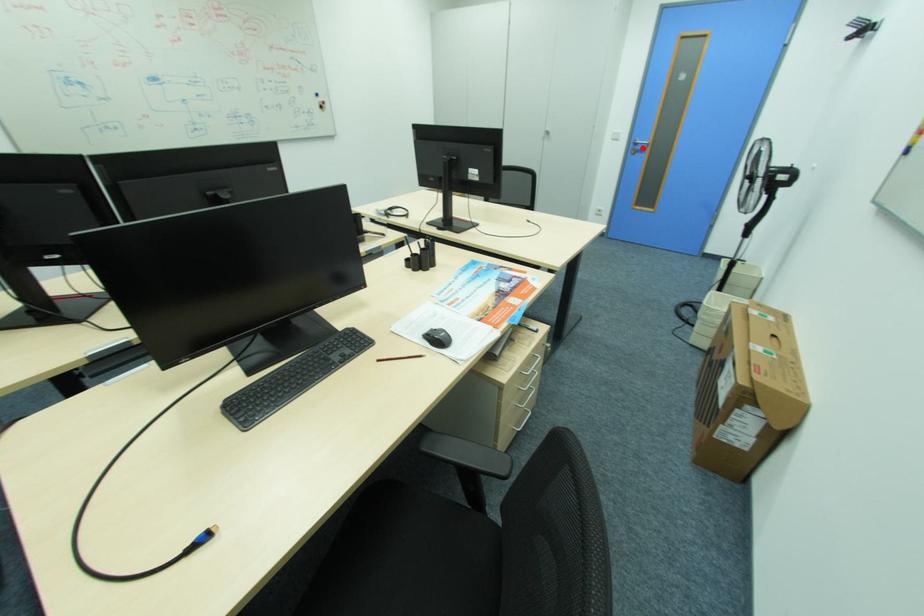
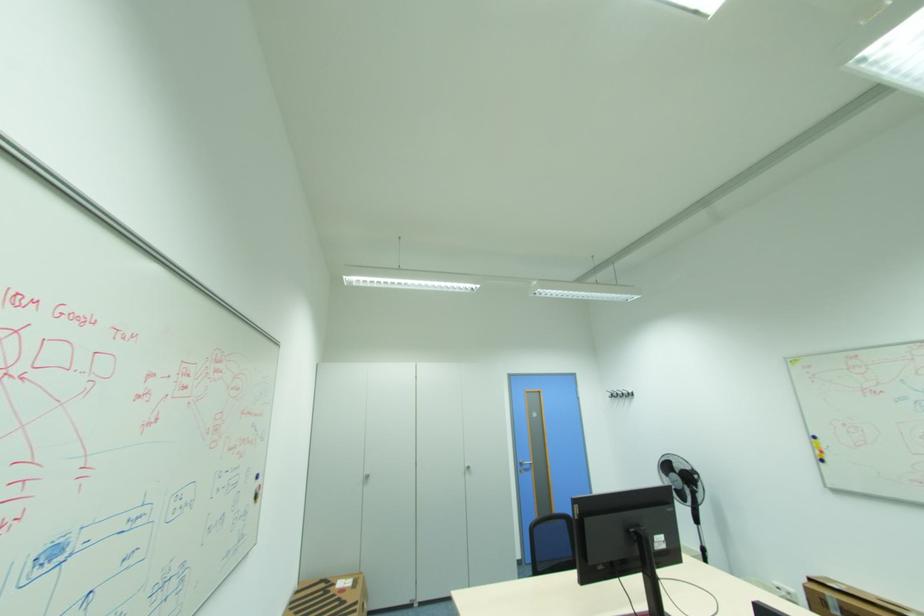
Find the pixel in the second image that matches the highlighted location in the first image.

(529, 467)